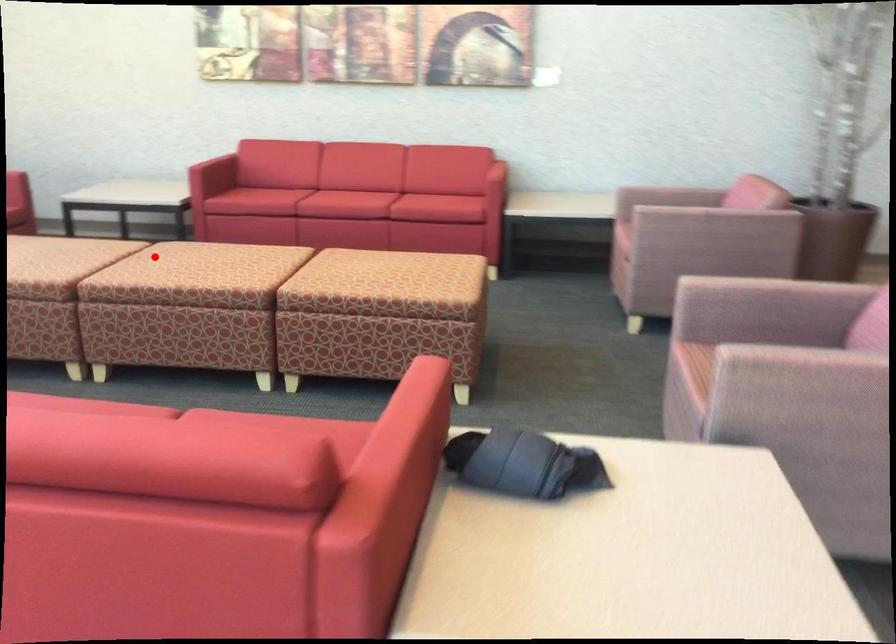
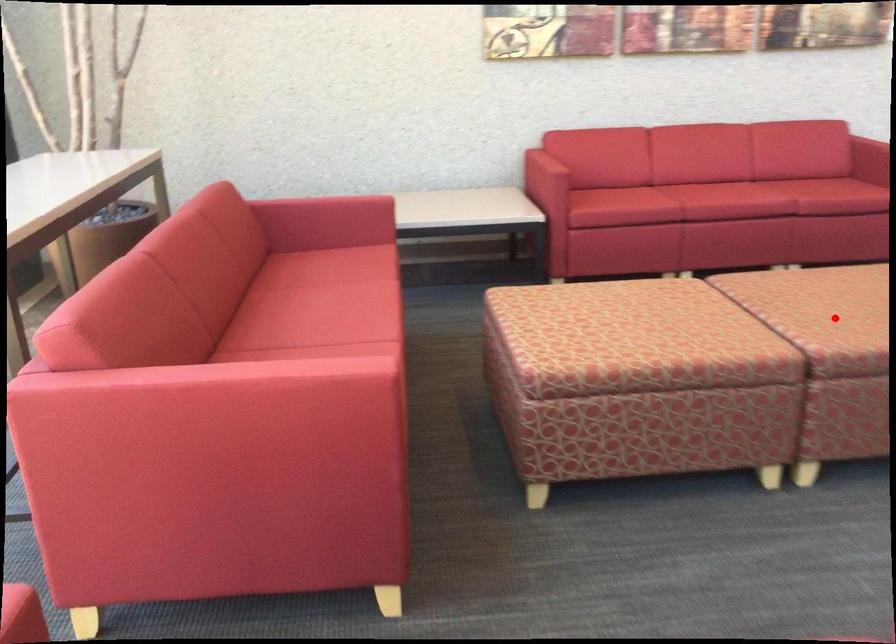
I am providing you with two images of the same scene from different viewpoints. A red point is marked on the first image and another point is marked on the second image. Is the red point in image1 aligned with the point shown in image2?

Yes